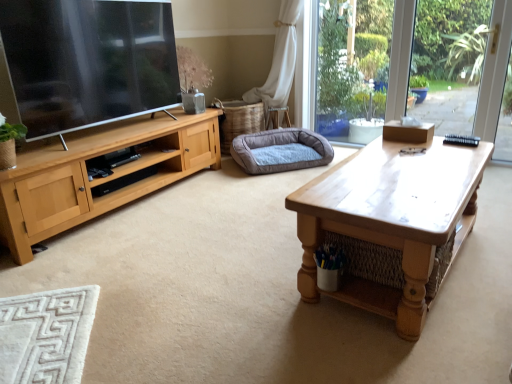
Question: From the image's perspective, is gray fabric dog bed at center above or below wooden coffee table at center?

Choices:
 (A) below
 (B) above

Answer: (B)

Question: Is point (301, 153) positioned closer to the camera than point (316, 238)?

Choices:
 (A) farther
 (B) closer

Answer: (A)

Question: Considering the positions of gray fabric dog bed at center and wooden coffee table at center in the image, is gray fabric dog bed at center bigger or smaller than wooden coffee table at center?

Choices:
 (A) small
 (B) big

Answer: (A)

Question: Is wooden coffee table at center spatially inside gray fabric dog bed at center, or outside of it?

Choices:
 (A) inside
 (B) outside

Answer: (B)

Question: Looking at the image, does wooden coffee table at center seem bigger or smaller compared to gray fabric dog bed at center?

Choices:
 (A) small
 (B) big

Answer: (B)

Question: From the image's perspective, relative to gray fabric dog bed at center, is wooden coffee table at center above or below?

Choices:
 (A) below
 (B) above

Answer: (A)

Question: From a real-world perspective, is wooden coffee table at center physically located above or below gray fabric dog bed at center?

Choices:
 (A) below
 (B) above

Answer: (B)